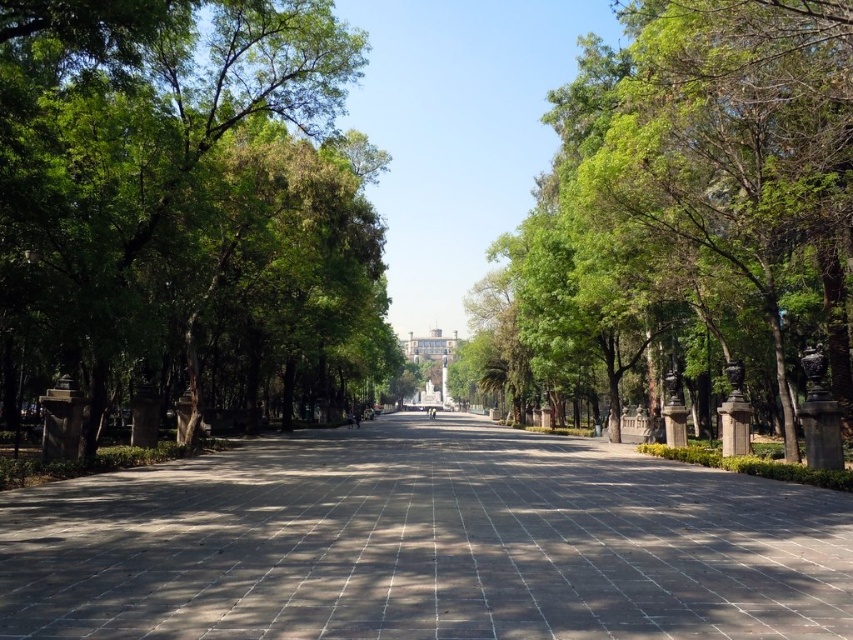
Describe the element at coordinates (425, 544) in the screenshot. The width and height of the screenshot is (853, 640). I see `dark gray paving stone at center` at that location.

Does dark gray paving stone at center appear over green leafy tree at left?

No, dark gray paving stone at center is not above green leafy tree at left.

I want to click on dark gray paving stone at center, so click(x=425, y=544).

Image resolution: width=853 pixels, height=640 pixels. What are the coordinates of `dark gray paving stone at center` in the screenshot? It's located at (425, 544).

Is point (78, 500) farther from camera compared to point (648, 241)?

No, (78, 500) is in front of (648, 241).

Which is above, dark gray paving stone at center or green leafy tree at center?

Positioned higher is green leafy tree at center.

Is point (473, 465) closer to camera compared to point (708, 115)?

Yes, point (473, 465) is in front of point (708, 115).

Where is `dark gray paving stone at center`? The height and width of the screenshot is (640, 853). dark gray paving stone at center is located at coordinates (425, 544).

Does green leafy tree at left appear on the right side of green leafy tree at center?

Incorrect, green leafy tree at left is not on the right side of green leafy tree at center.

Who is more forward, (196, 129) or (740, 225)?

Positioned in front is point (196, 129).

The width and height of the screenshot is (853, 640). In order to click on green leafy tree at left in this screenshot , I will do `click(184, 208)`.

Locate an element on the screen. The image size is (853, 640). green leafy tree at left is located at coordinates (184, 208).